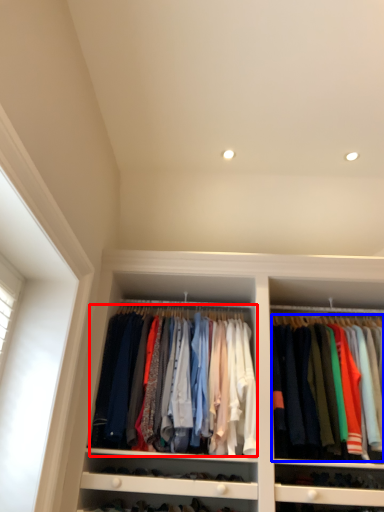
Question: Which of the following is the closest to the observer, clothing (highlighted by a red box) or clothing (highlighted by a blue box)?

Choices:
 (A) clothing
 (B) clothing

Answer: (B)